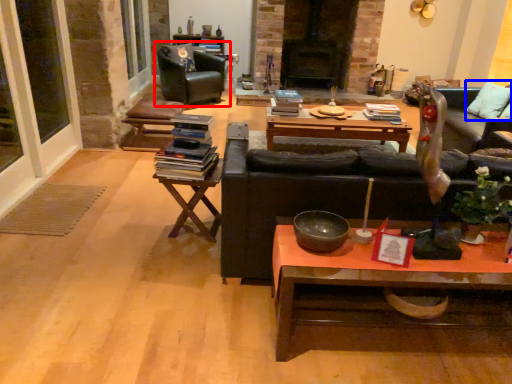
Question: Which of the following is the closest to the observer, chair (highlighted by a red box) or pillow (highlighted by a blue box)?

Choices:
 (A) chair
 (B) pillow

Answer: (B)